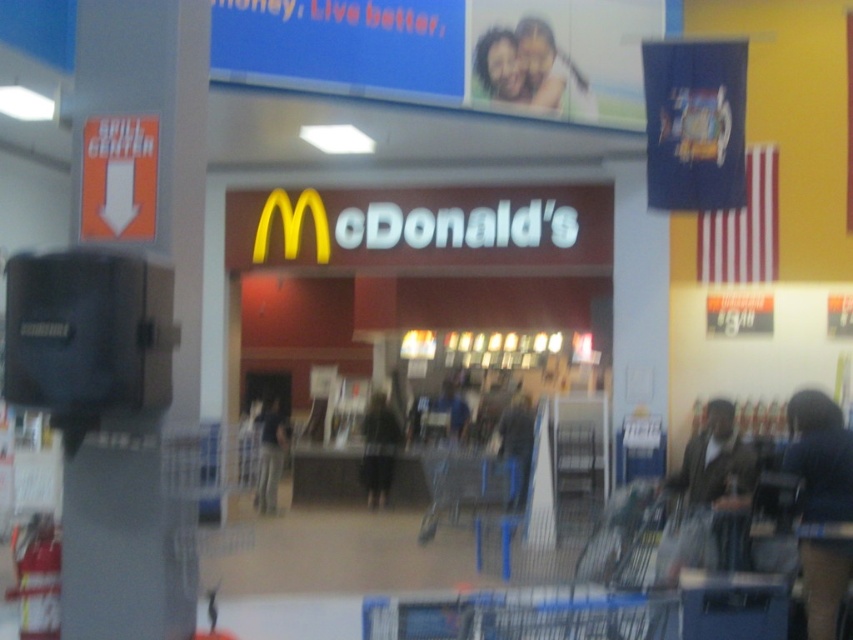
Question: Is smooth skin face at upper center thinner than dark gray pants at center?

Choices:
 (A) no
 (B) yes

Answer: (A)

Question: Estimate the real-world distances between objects in this image. Which object is farther from the dark gray pants at center?

Choices:
 (A) smooth skin face at upper center
 (B) black fuzzy coat at center
 (C) blue denim jeans at center
 (D) dark brown leather jacket at lower right

Answer: (D)

Question: Which of the following is the farthest from the observer?

Choices:
 (A) dark gray pants at center
 (B) black fuzzy coat at center
 (C) smooth skin face at upper center
 (D) dark brown leather jacket at lower right

Answer: (B)

Question: Which point appears closest to the camera in this image?

Choices:
 (A) (520, 394)
 (B) (815, 397)
 (C) (373, 401)

Answer: (B)

Question: Is dark blue fabric at lower right positioned at the back of dark gray pants at center?

Choices:
 (A) yes
 (B) no

Answer: (B)

Question: Does dark blue fabric at lower right have a greater width compared to black fuzzy coat at center?

Choices:
 (A) yes
 (B) no

Answer: (B)